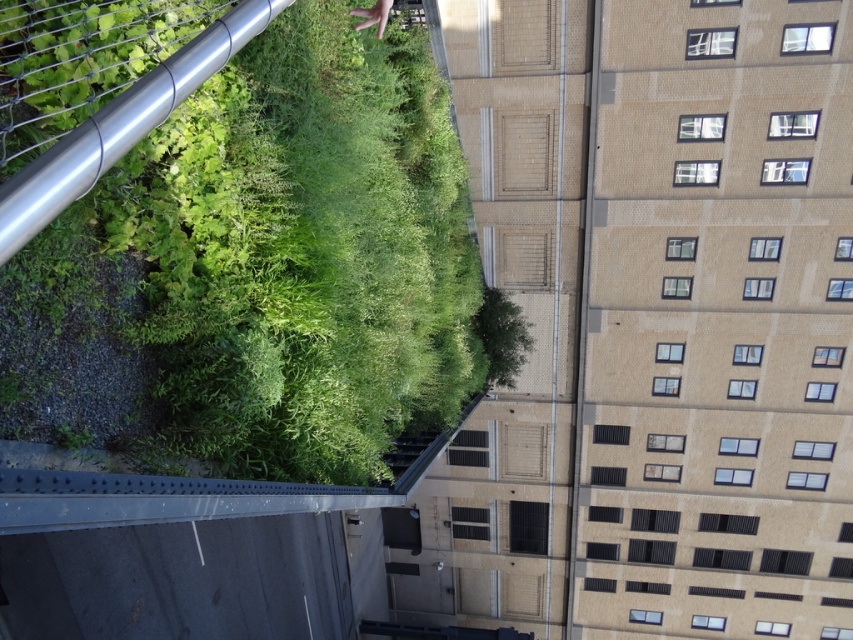
You are standing at the center of the image. Which direction should you look to see the green leafy plant at upper left?

The green leafy plant at upper left is located at the upper left direction from your current position at the center of the image.

You are standing in the scene between the two points, point (x=236, y=461) and point (x=387, y=16). Which point is nearer to you?

Point (x=236, y=461) is closer to the viewer than point (x=387, y=16).